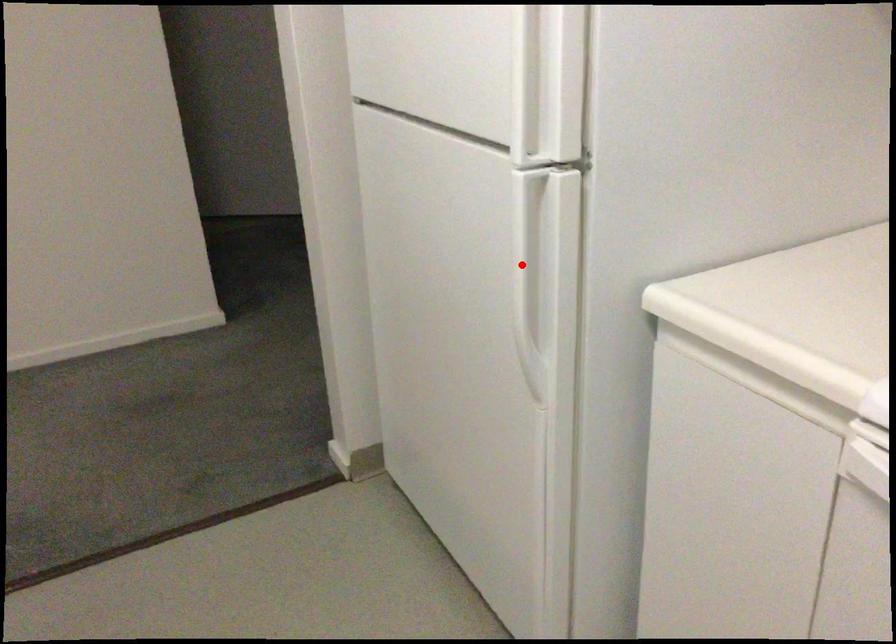
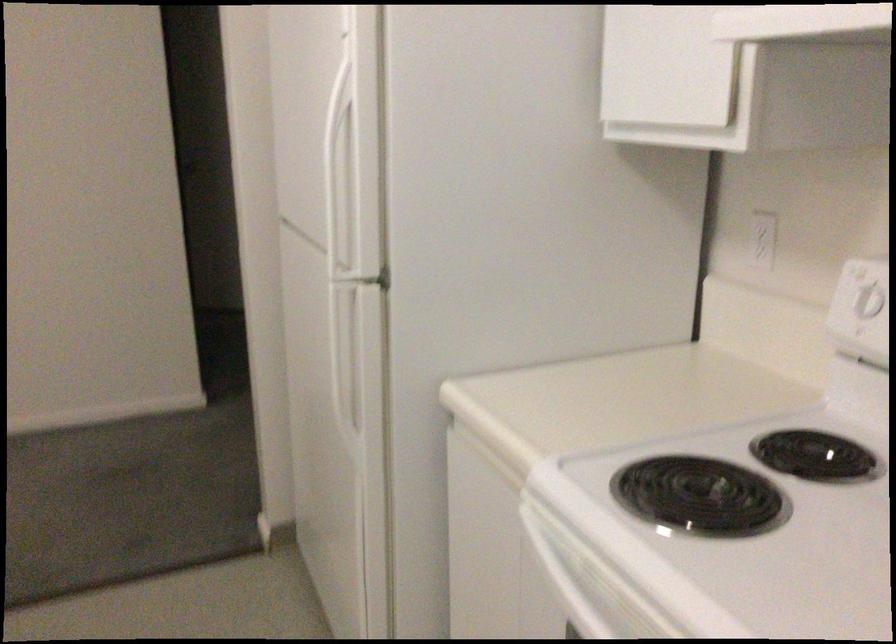
Question: I am providing you with two images of the same scene from different viewpoints. Given a red point in image1, look at the same physical point in image2. Is it:

Choices:
 (A) Closer to the viewpoint
 (B) Farther from the viewpoint

Answer: (B)